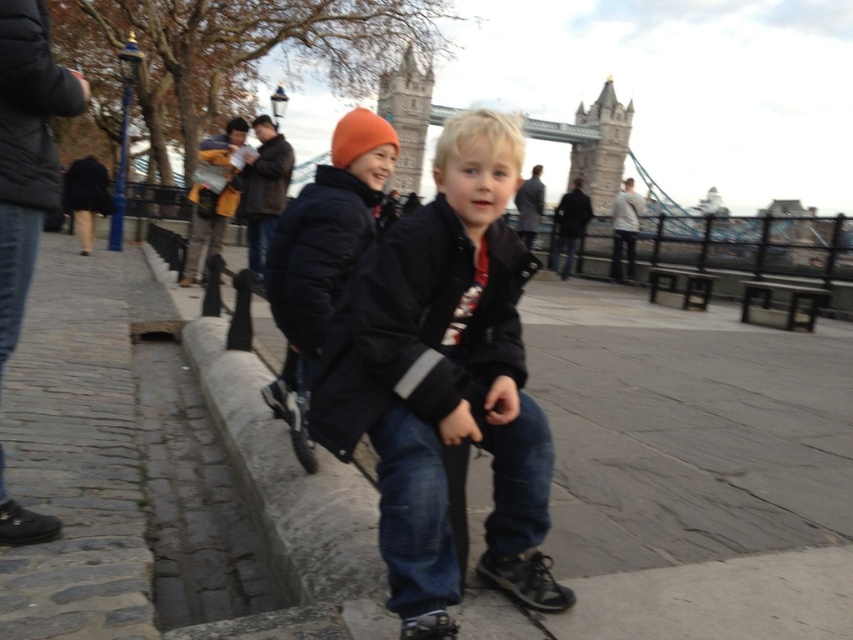
Question: Among these points, which one is nearest to the camera?

Choices:
 (A) (734, 444)
 (B) (579, 112)
 (C) (399, 396)
 (D) (347, 196)

Answer: (C)

Question: Is matte black jacket at center behind black matte jacket at center?

Choices:
 (A) yes
 (B) no

Answer: (B)

Question: Does puffy black jacket at center come behind stone tower bridge at center?

Choices:
 (A) yes
 (B) no

Answer: (B)

Question: Can you confirm if black matte jacket at center is positioned below puffy black jacket at center?

Choices:
 (A) no
 (B) yes

Answer: (B)

Question: Which point is closer to the camera taking this photo?

Choices:
 (A) click(352, 628)
 (B) click(308, 205)
 (C) click(380, 90)
 (D) click(312, 392)

Answer: (A)

Question: Which object is the farthest from the puffy black jacket at center?

Choices:
 (A) black matte jacket at center
 (B) smooth concrete pavement at center
 (C) matte black jacket at center
 (D) stone tower bridge at center

Answer: (D)